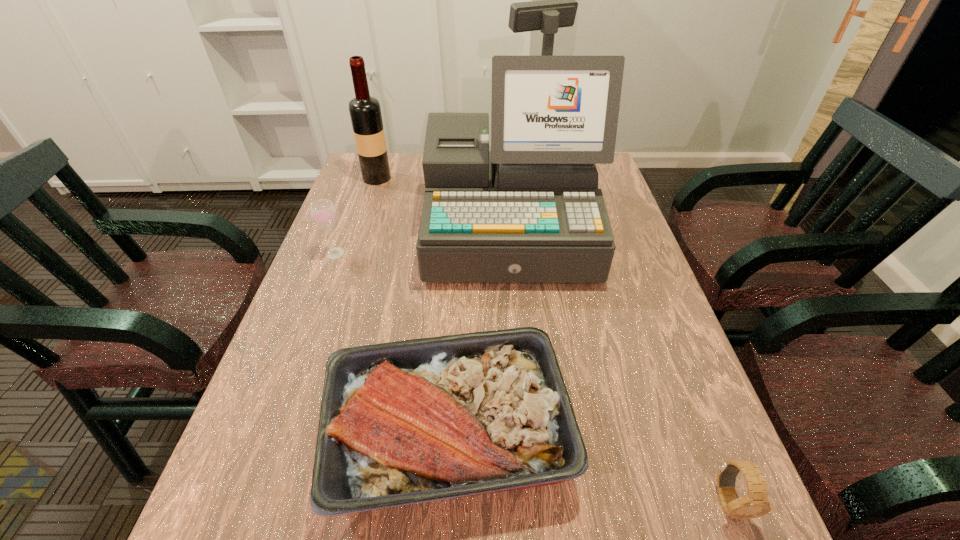
Point out which object is positioned as the fourth nearest to the tray. Please provide its 2D coordinates. Your answer should be formatted as a tuple, i.e. [(x, y)], where the tuple contains the x and y coordinates of a point satisfying the conditions above.

[(365, 112)]

Identify the location of object that is the fourth nearest to the shortest object. The width and height of the screenshot is (960, 540). (365, 112).

At what (x,y) coordinates should I click in order to perform the action: click on free region that satisfies the following two spatial constraints: 1. on the front side of the tray; 2. on the right side of the third tallest object. Please return your answer as a coordinate pair (x, y). This screenshot has width=960, height=540. Looking at the image, I should click on (268, 434).

Find the location of a particular element. Image resolution: width=960 pixels, height=540 pixels. vacant area that satisfies the following two spatial constraints: 1. on the front side of the fourth shortest object; 2. on the right side of the tray is located at coordinates (293, 434).